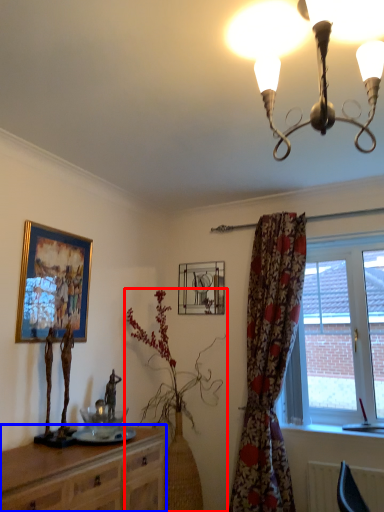
Question: Which of the following is the farthest to the observer, houseplant (highlighted by a red box) or cabinetry (highlighted by a blue box)?

Choices:
 (A) houseplant
 (B) cabinetry

Answer: (A)